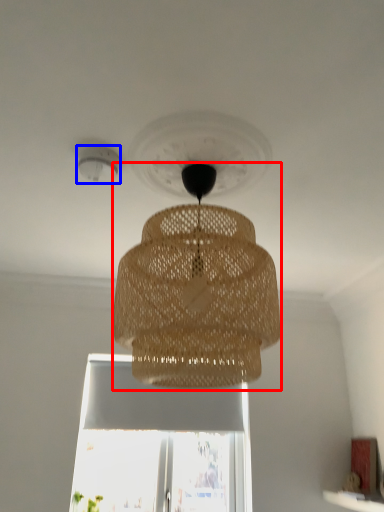
Question: Which point is further to the camera, lamp (highlighted by a red box) or lighting (highlighted by a blue box)?

Choices:
 (A) lamp
 (B) lighting

Answer: (B)